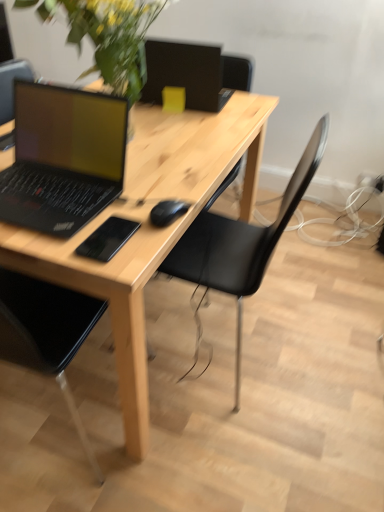
This screenshot has width=384, height=512. Identify the location of free space underneath black plastic chair at center (from a real-world perspective). (247, 336).